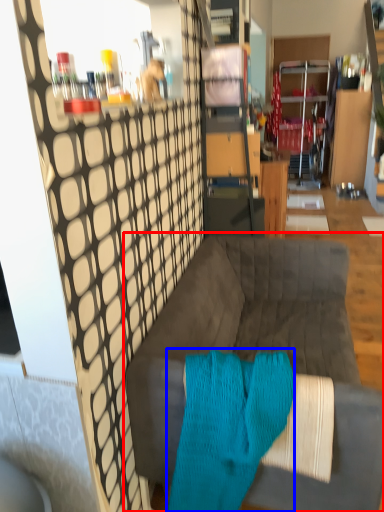
Question: Which of the following is the closest to the observer, studio couch (highlighted by a red box) or aqua (highlighted by a blue box)?

Choices:
 (A) studio couch
 (B) aqua

Answer: (B)